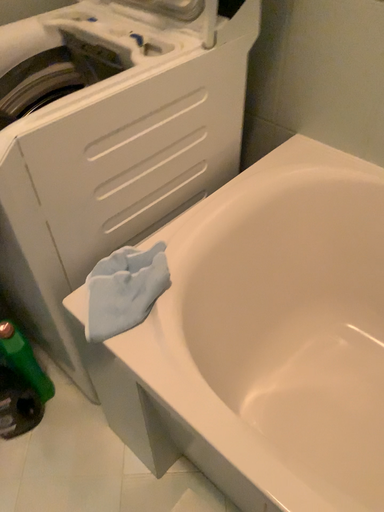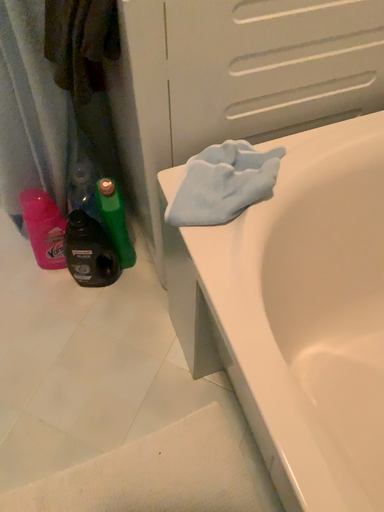
Question: Which way did the camera rotate in the video?

Choices:
 (A) rotated right
 (B) rotated left

Answer: (B)